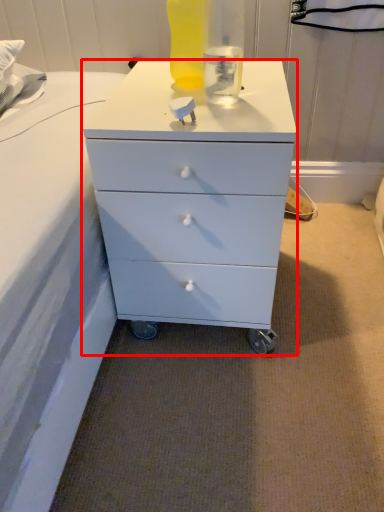
Question: Observing the image, what is the correct spatial positioning of chest of drawers (annotated by the red box) in reference to bottle?

Choices:
 (A) right
 (B) left

Answer: (A)